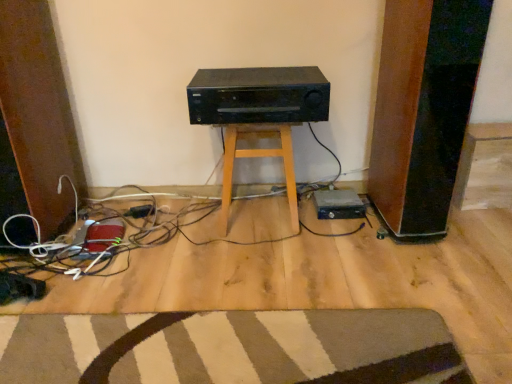
In order to click on unoccupied area in front of wooden stool at center in this screenshot , I will do `click(258, 257)`.